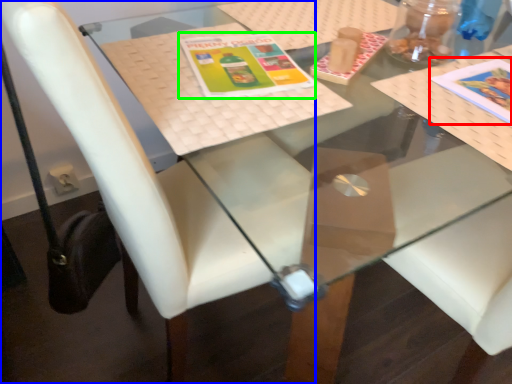
Question: Based on their relative distances, which object is farther from book cover (highlighted by a red box)? Choose from chair (highlighted by a blue box) and book cover (highlighted by a green box).

Choices:
 (A) chair
 (B) book cover

Answer: (A)